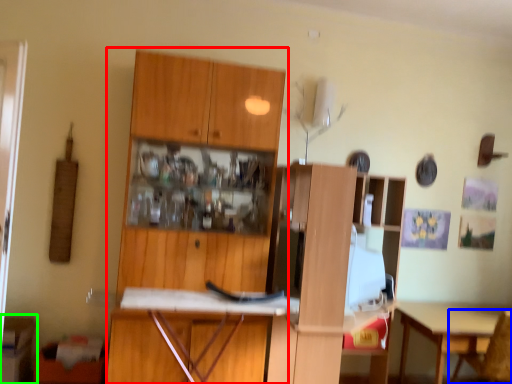
Question: Which object is positioned farthest from cabinetry (highlighted by a red box)? Select from chair (highlighted by a blue box) and cabinetry (highlighted by a green box).

Choices:
 (A) chair
 (B) cabinetry

Answer: (A)